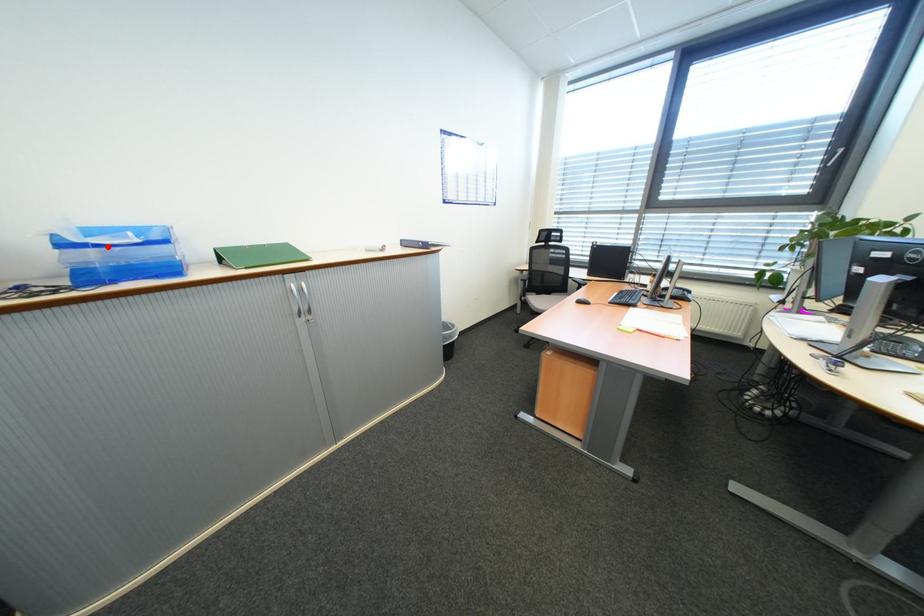
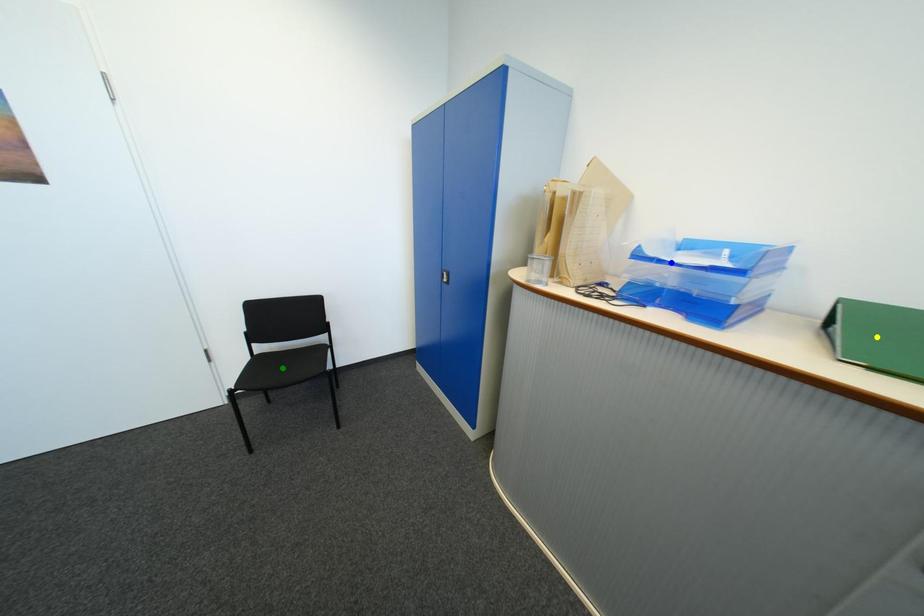
Question: I am providing you with two images of the same scene from different viewpoints. A red point is marked on the first image. You are given multiple points on the second image. In image 2, which mark is for the same physical point as the one in image 1?

Choices:
 (A) yellow point
 (B) blue point
 (C) green point

Answer: (B)